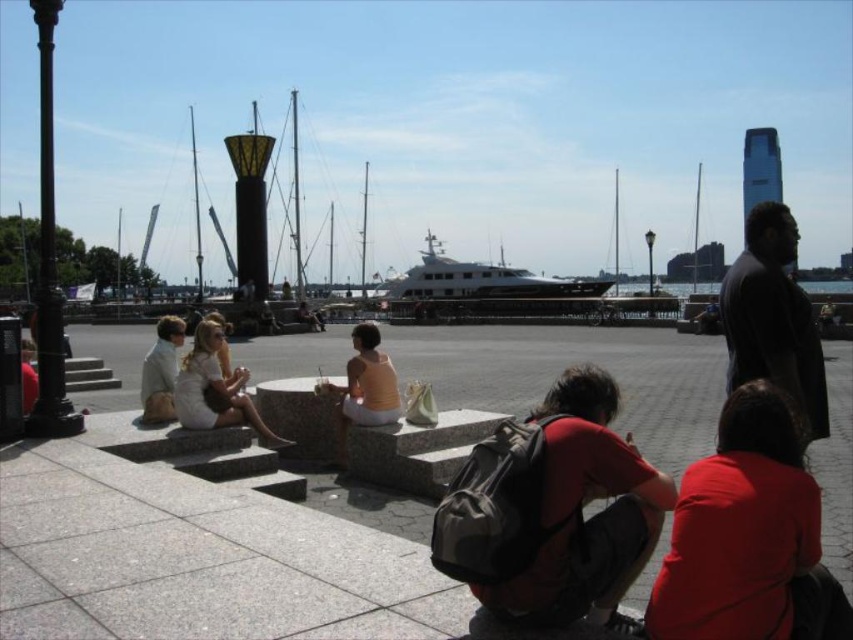
Is matte red shirt at lower right smaller than white cotton dress at center?

No.

Is matte red shirt at lower right to the left of white cotton dress at center from the viewer's perspective?

Incorrect, matte red shirt at lower right is not on the left side of white cotton dress at center.

Find the location of `matte red shirt at lower right`. matte red shirt at lower right is located at coordinates (747, 536).

Between matte red shirt at lower right and white glossy yacht at center, which one is positioned higher?

white glossy yacht at center

Does matte red shirt at lower right have a lesser width compared to white glossy yacht at center?

Correct, matte red shirt at lower right's width is less than white glossy yacht at center's.

Identify the location of matte red shirt at lower right. (747, 536).

Where is `matte red shirt at lower right`? The height and width of the screenshot is (640, 853). matte red shirt at lower right is located at coordinates (747, 536).

From the picture: Is red cotton shirt at lower right to the left of light beige fabric dress at lower left from the viewer's perspective?

No, red cotton shirt at lower right is not to the left of light beige fabric dress at lower left.

From the picture: Is red cotton shirt at lower right closer to the viewer compared to light beige fabric dress at lower left?

Yes.

Between point (540, 576) and point (160, 362), which one is positioned behind?

Point (160, 362)

Where is `red cotton shirt at lower right`? red cotton shirt at lower right is located at coordinates (579, 513).